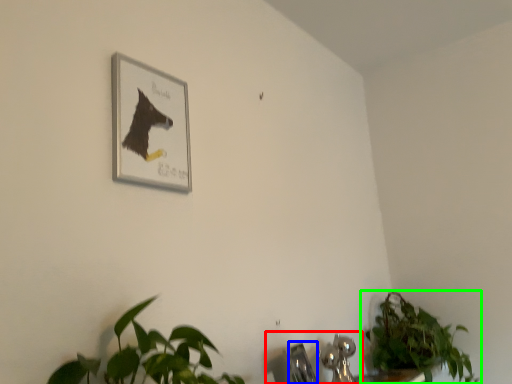
Question: Estimate the real-world distances between objects in this image. Which object is closer to sink (highlighted by a red box), faucet (highlighted by a blue box) or houseplant (highlighted by a green box)?

Choices:
 (A) faucet
 (B) houseplant

Answer: (A)